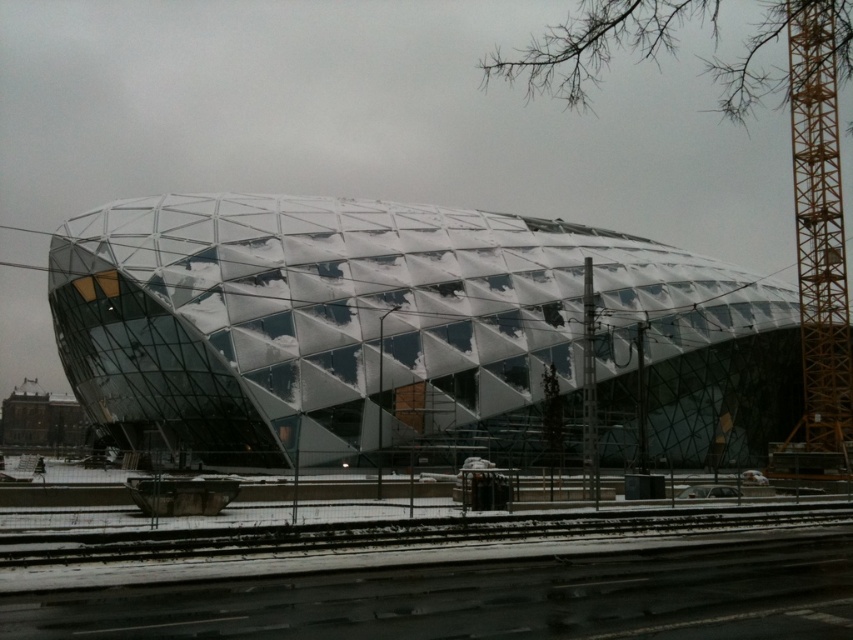
Question: From the image, what is the correct spatial relationship of metallic glass dome at center in relation to yellow metallic crane at right?

Choices:
 (A) below
 (B) above

Answer: (A)

Question: Which point is closer to the camera taking this photo?

Choices:
 (A) (805, 116)
 (B) (718, 440)

Answer: (A)

Question: Which point is closer to the camera taking this photo?

Choices:
 (A) (813, 122)
 (B) (683, 394)

Answer: (A)

Question: Is metallic glass dome at center thinner than yellow metallic crane at right?

Choices:
 (A) no
 (B) yes

Answer: (A)

Question: Is metallic glass dome at center bigger than yellow metallic crane at right?

Choices:
 (A) yes
 (B) no

Answer: (A)